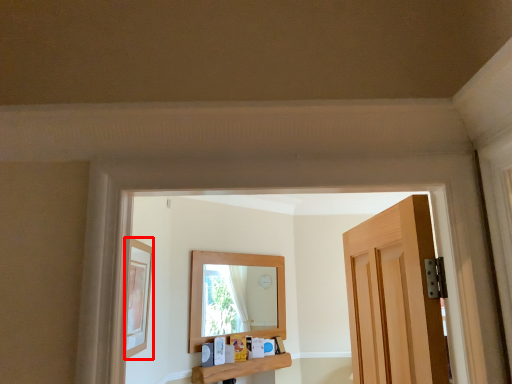
Question: From the image's perspective, where is picture frame (annotated by the red box) located relative to window sill?

Choices:
 (A) above
 (B) below

Answer: (A)